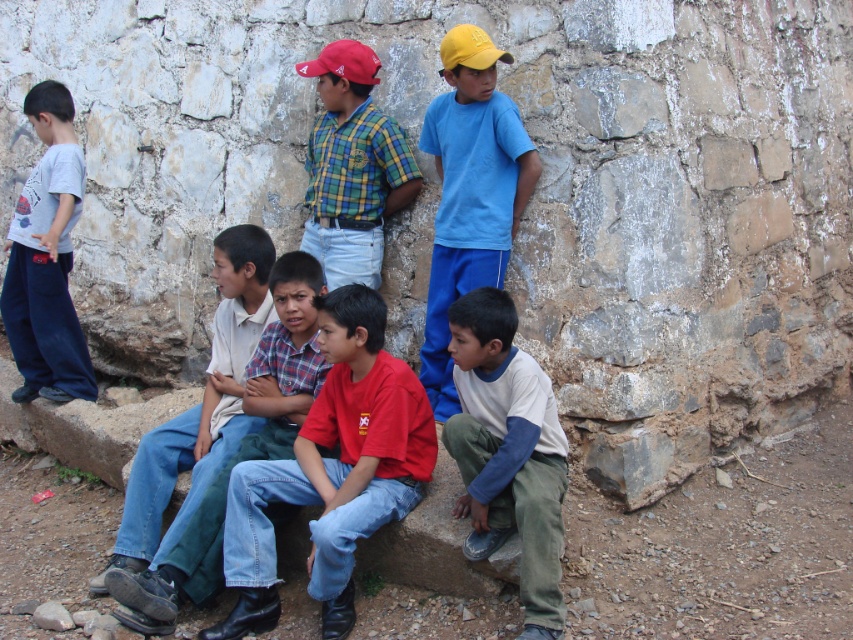
Question: Is jeans at center positioned before matte gray t-shirt at left?

Choices:
 (A) yes
 (B) no

Answer: (A)

Question: Can you confirm if jeans at center is thinner than plaid shirt at center?

Choices:
 (A) no
 (B) yes

Answer: (A)

Question: In this image, where is red cotton shirt at center located relative to matte gray t-shirt at left?

Choices:
 (A) above
 (B) below

Answer: (B)

Question: Which object is farther from the camera taking this photo?

Choices:
 (A) yellow matte baseball cap at upper center
 (B) plaid shirt at center
 (C) matte red baseball cap at upper center

Answer: (B)

Question: Which point appears farthest from the camera in this image?

Choices:
 (A) 479,67
 (B) 503,301
 (C) 418,419

Answer: (A)

Question: Which point is closer to the camera?

Choices:
 (A) white fleece pants at lower right
 (B) matte red baseball cap at upper center
 (C) plaid shirt at center
 (D) blue cotton shirt at upper center

Answer: (A)